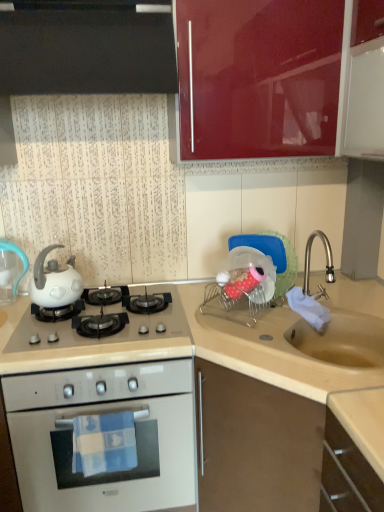
Question: From a real-world perspective, relative to beige matte sink at lower right, positioned as the first cabinetry in bottom-to-top order, is black glossy cabinet at upper left, positioned as the first cabinetry in top-to-bottom order, vertically above or below?

Choices:
 (A) below
 (B) above

Answer: (B)

Question: Considering the relative positions of black glossy cabinet at upper left, positioned as the first cabinetry in top-to-bottom order, and beige matte sink at lower right, positioned as the first cabinetry in bottom-to-top order, in the image provided, is black glossy cabinet at upper left, positioned as the first cabinetry in top-to-bottom order, to the left or to the right of beige matte sink at lower right, positioned as the first cabinetry in bottom-to-top order,?

Choices:
 (A) right
 (B) left

Answer: (B)

Question: Considering the real-world distances, which object is farthest from the white glossy gas stove at center?

Choices:
 (A) white glossy kettle at left
 (B) white glossy teapot at left
 (C) glossy red cabinet at upper center, the second cabinetry viewed from the top
 (D) beige matte sink at lower right, positioned as the first cabinetry in bottom-to-top order
 (E) white glossy oven at lower left

Answer: (C)

Question: Which object is positioned closest to the glossy red cabinet at upper center, the second cabinetry viewed from the top?

Choices:
 (A) white glossy oven at lower left
 (B) blue cotton towel at lower center
 (C) white glossy gas stove at center
 (D) beige matte sink at lower right, the third cabinetry viewed from the top
 (E) white glossy kettle at left

Answer: (C)